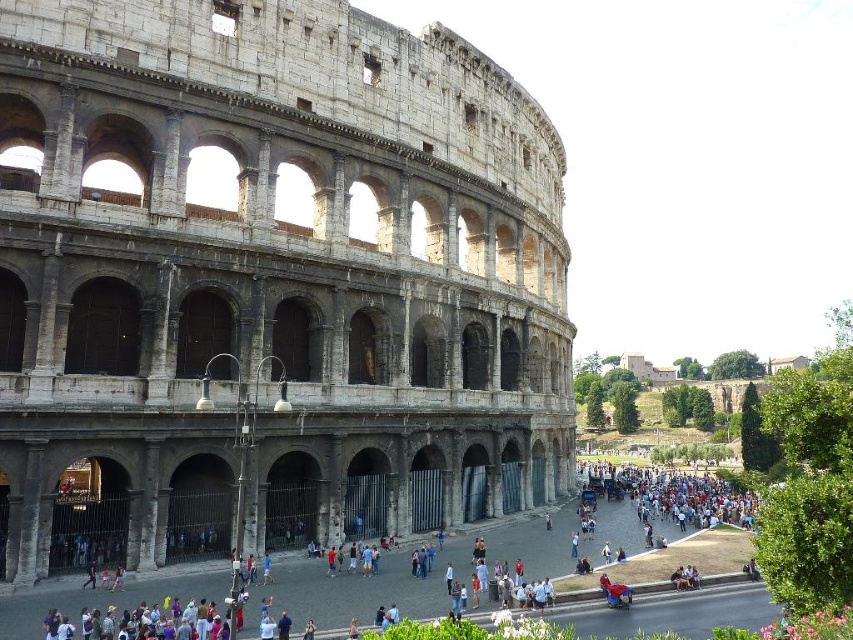
Is point (144, 214) farther from camera compared to point (302, 611)?

Yes, point (144, 214) is behind point (302, 611).

This screenshot has height=640, width=853. What are the coordinates of `gray stone amphitheater at center` in the screenshot? It's located at (273, 276).

Is point (379, 264) behind point (289, 593)?

Yes.

The image size is (853, 640). Identify the location of gray stone amphitheater at center. (273, 276).